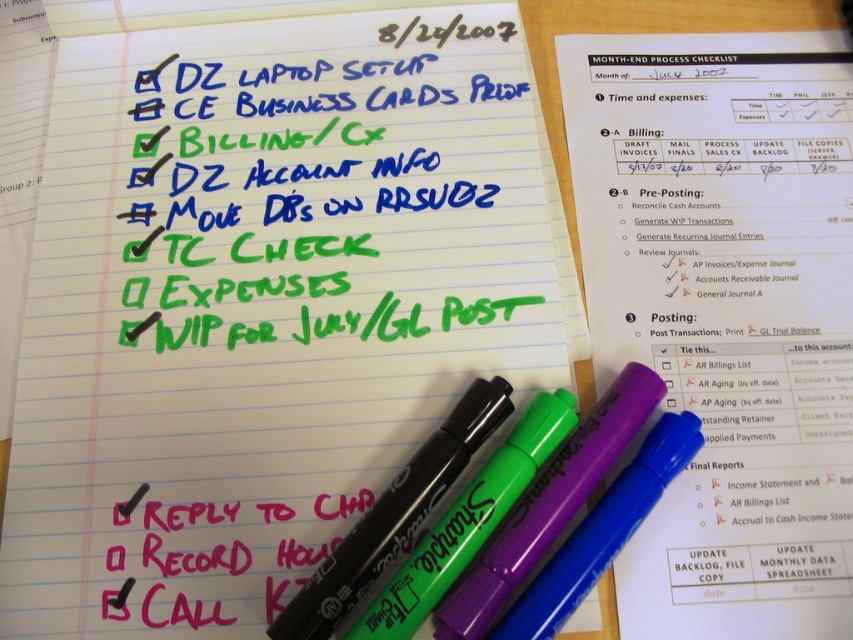
Who is lower down, white lined paper at center or green marker at center?

green marker at center is below.

Is point (16, 556) closer to camera compared to point (630, 378)?

Yes.

Is point (294, 161) positioned after point (474, 618)?

That is True.

You are a GUI agent. You are given a task and a screenshot of the screen. Output one action in this format:
    pyautogui.click(x=<x>, y=<y>)
    Task: Click on the white lined paper at center
    This screenshot has height=640, width=853.
    Given the screenshot: What is the action you would take?
    [x=264, y=296]

Is white lined paper at center to the right of black smoothie marker at center from the viewer's perspective?

Incorrect, white lined paper at center is not on the right side of black smoothie marker at center.

This screenshot has height=640, width=853. In order to click on white lined paper at center in this screenshot , I will do `click(264, 296)`.

The width and height of the screenshot is (853, 640). I want to click on white lined paper at center, so click(x=264, y=296).

Who is more forward, (630, 588) or (463, 404)?

Positioned in front is point (630, 588).

The height and width of the screenshot is (640, 853). What do you see at coordinates (726, 312) in the screenshot?
I see `white paper at upper center` at bounding box center [726, 312].

Where is `white paper at upper center`? The image size is (853, 640). white paper at upper center is located at coordinates (726, 312).